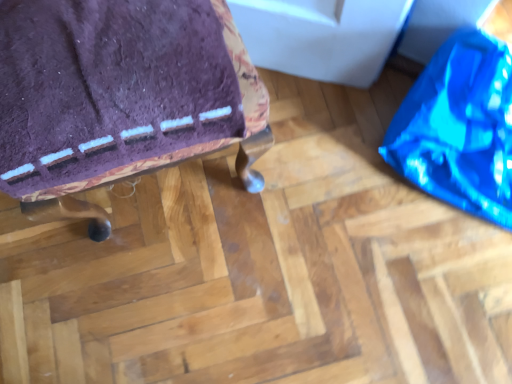
What do you see at coordinates (459, 127) in the screenshot?
I see `shiny blue bean bag at right` at bounding box center [459, 127].

In the scene shown: In order to face shiny blue bean bag at right, should I rotate leftwards or rightwards?

It's best to rotate right around 28.539 degrees.

What is the approximate height of shiny blue bean bag at right?

12.26 inches.

Image resolution: width=512 pixels, height=384 pixels. I want to click on shiny blue bean bag at right, so click(459, 127).

What is the approximate height of purple fabric cushion at upper left?

18.57 inches.

At what (x,y) coordinates should I click in order to perform the action: click on purple fabric cushion at upper left. Please return your answer as a coordinate pair (x, y). Looking at the image, I should click on (120, 98).

Describe the element at coordinates (120, 98) in the screenshot. I see `purple fabric cushion at upper left` at that location.

Locate an element on the screen. This screenshot has height=384, width=512. shiny blue bean bag at right is located at coordinates (459, 127).

Based on their positions, is shiny blue bean bag at right located to the left or right of purple fabric cushion at upper left?

From the image, it's evident that shiny blue bean bag at right is to the right of purple fabric cushion at upper left.

From the picture: Considering the positions of objects shiny blue bean bag at right and purple fabric cushion at upper left in the image provided, who is behind, shiny blue bean bag at right or purple fabric cushion at upper left?

shiny blue bean bag at right is behind.

Is point (452, 187) farther from viewer compared to point (21, 203)?

Yes, it is.

From the image's perspective, who appears lower, shiny blue bean bag at right or purple fabric cushion at upper left?

purple fabric cushion at upper left, from the image's perspective.

From a real-world perspective, between shiny blue bean bag at right and purple fabric cushion at upper left, who is vertically higher?

purple fabric cushion at upper left.

Which of these two, shiny blue bean bag at right or purple fabric cushion at upper left, is wider?

shiny blue bean bag at right is wider.

Considering the sizes of objects shiny blue bean bag at right and purple fabric cushion at upper left in the image provided, who is shorter, shiny blue bean bag at right or purple fabric cushion at upper left?

Standing shorter between the two is shiny blue bean bag at right.

From the picture: Looking at the image, does shiny blue bean bag at right seem bigger or smaller compared to purple fabric cushion at upper left?

Result: Considering their sizes, shiny blue bean bag at right takes up less space than purple fabric cushion at upper left.

Would you say shiny blue bean bag at right contains purple fabric cushion at upper left?

Actually, purple fabric cushion at upper left is outside shiny blue bean bag at right.

Is shiny blue bean bag at right beside purple fabric cushion at upper left?

No, shiny blue bean bag at right is not beside purple fabric cushion at upper left.

Is shiny blue bean bag at right oriented towards purple fabric cushion at upper left?

No, shiny blue bean bag at right is not aimed at purple fabric cushion at upper left.

How different are the orientations of shiny blue bean bag at right and purple fabric cushion at upper left in degrees?

There is a 38.5-degree angle between the facing directions of shiny blue bean bag at right and purple fabric cushion at upper left.

Where is `bean bag chair that is above the purple fabric cushion at upper left (from the image's perspective)`? bean bag chair that is above the purple fabric cushion at upper left (from the image's perspective) is located at coordinates (459, 127).

Looking at this image, in the image, is purple fabric cushion at upper left on the left side or the right side of shiny blue bean bag at right?

Based on their positions, purple fabric cushion at upper left is located to the left of shiny blue bean bag at right.

Does purple fabric cushion at upper left lie in front of shiny blue bean bag at right?

Yes.

Does point (23, 65) lie behind point (502, 226)?

No, (23, 65) is closer to viewer.

From the image's perspective, is purple fabric cushion at upper left positioned above or below shiny blue bean bag at right?

purple fabric cushion at upper left is situated lower than shiny blue bean bag at right in the image.

From a real-world perspective, between purple fabric cushion at upper left and shiny blue bean bag at right, who is vertically lower?

In real-world perspective, shiny blue bean bag at right is lower.

Is purple fabric cushion at upper left wider or thinner than shiny blue bean bag at right?

Considering their sizes, purple fabric cushion at upper left looks slimmer than shiny blue bean bag at right.

Based on the photo, who is shorter, purple fabric cushion at upper left or shiny blue bean bag at right?

shiny blue bean bag at right.

Who is smaller, purple fabric cushion at upper left or shiny blue bean bag at right?

shiny blue bean bag at right.

Which is correct: purple fabric cushion at upper left is inside shiny blue bean bag at right, or outside of it?

purple fabric cushion at upper left is outside shiny blue bean bag at right.

Are purple fabric cushion at upper left and shiny blue bean bag at right beside each other?

No, purple fabric cushion at upper left is not next to shiny blue bean bag at right.

Is purple fabric cushion at upper left aimed at shiny blue bean bag at right?

No, purple fabric cushion at upper left is not oriented towards shiny blue bean bag at right.

How many degrees apart are the facing directions of purple fabric cushion at upper left and shiny blue bean bag at right?

There is a 38.5-degree angle between the facing directions of purple fabric cushion at upper left and shiny blue bean bag at right.

The image size is (512, 384). I want to click on bean bag chair above the purple fabric cushion at upper left (from the image's perspective), so click(459, 127).

Image resolution: width=512 pixels, height=384 pixels. Identify the location of furniture in front of the shiny blue bean bag at right. (120, 98).

At what (x,y) coordinates should I click in order to perform the action: click on furniture on the left of the shiny blue bean bag at right. Please return your answer as a coordinate pair (x, y). This screenshot has width=512, height=384. Looking at the image, I should click on (120, 98).